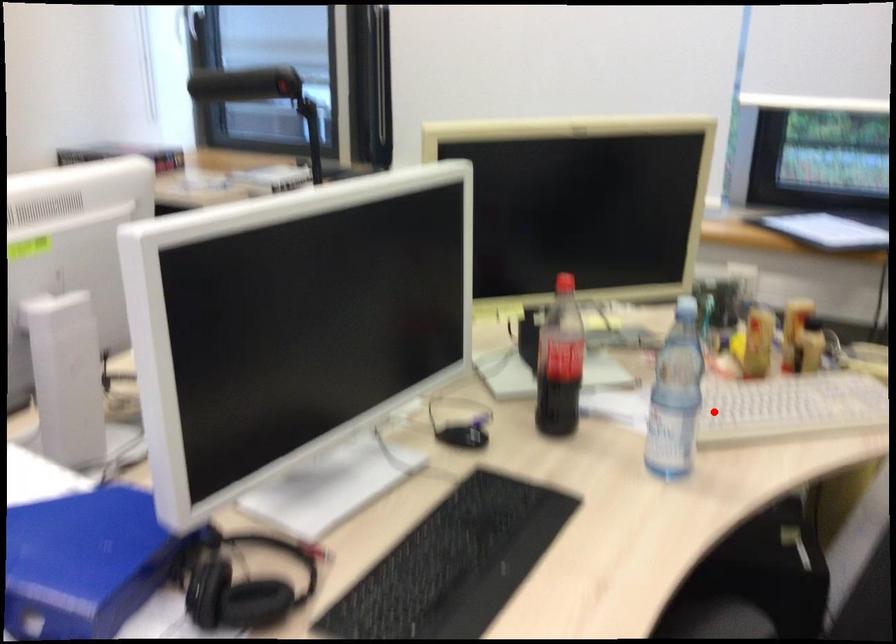
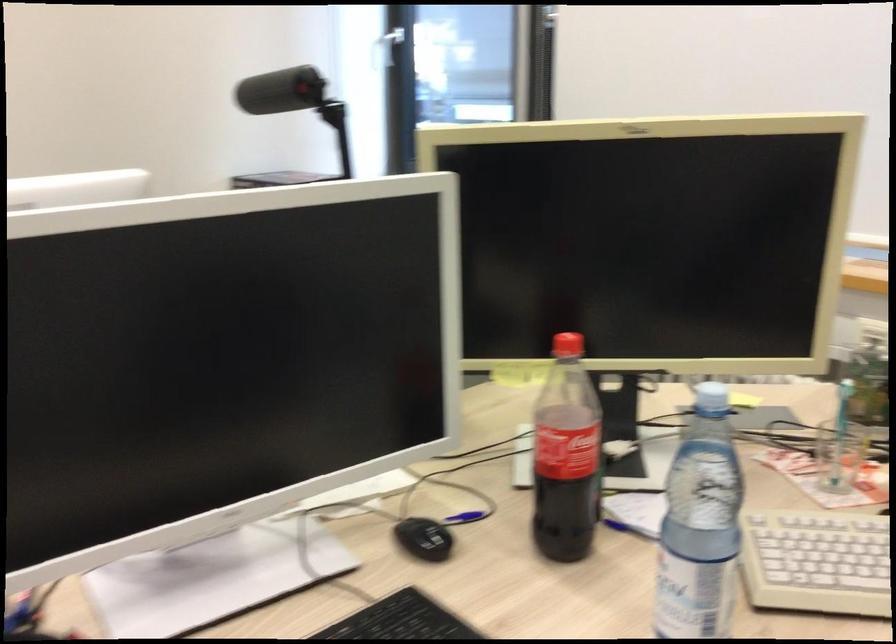
Question: I am providing you with two images of the same scene from different viewpoints. Image1 has a red point marked. In image2, the corresponding 3D location appears at what relative position? Reply with the corresponding letter.

Choices:
 (A) Closer
 (B) Farther

Answer: (A)